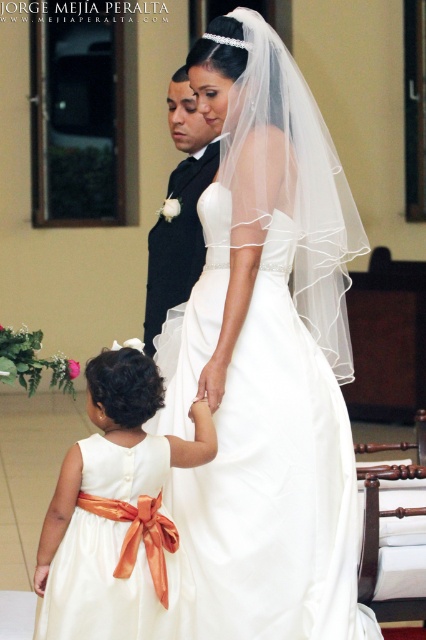
In the wedding scene, you are standing at the center of the image and want to move towards the white satin dress at lower left. Which direction should you move to reach it?

To reach the white satin dress at lower left, you should move towards the lower left direction since it is located at point (115, 512), which is lower left in the image coordinate system.

You are a photographer at a wedding. You see the white satin dress at center and the black satin suit at center. Which one is closer to the camera?

The white satin dress at center is closer to the camera because it is in front of the black satin suit at center.